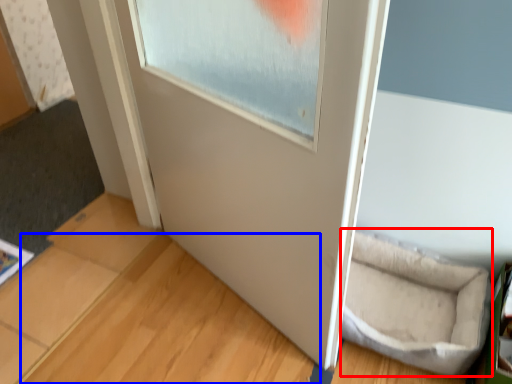
Question: Which point is further to the camera, wide (highlighted by a red box) or wood (highlighted by a blue box)?

Choices:
 (A) wide
 (B) wood

Answer: (A)